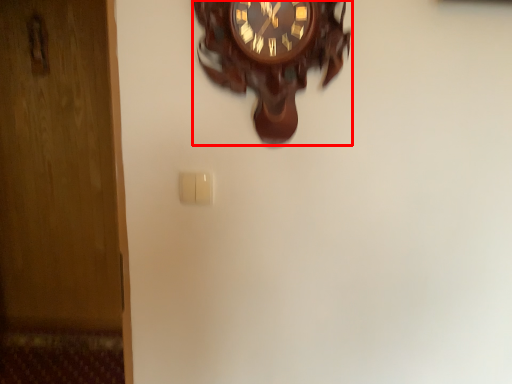
Question: Observing the image, what is the correct spatial positioning of wall clock (annotated by the red box) in reference to light switch?

Choices:
 (A) right
 (B) left

Answer: (A)